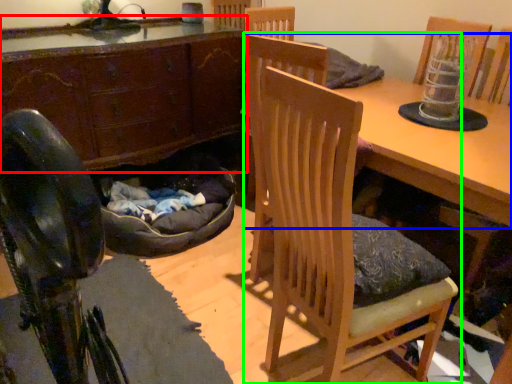
Question: Based on their relative distances, which object is farther from cabinetry (highlighted by a red box)? Choose from table (highlighted by a blue box) and chair (highlighted by a green box).

Choices:
 (A) table
 (B) chair

Answer: (A)